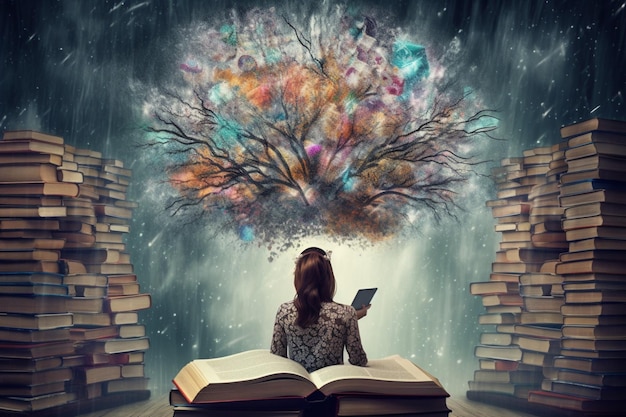
The width and height of the screenshot is (626, 417). Find the location of `table`. table is located at coordinates (153, 405), (478, 408).